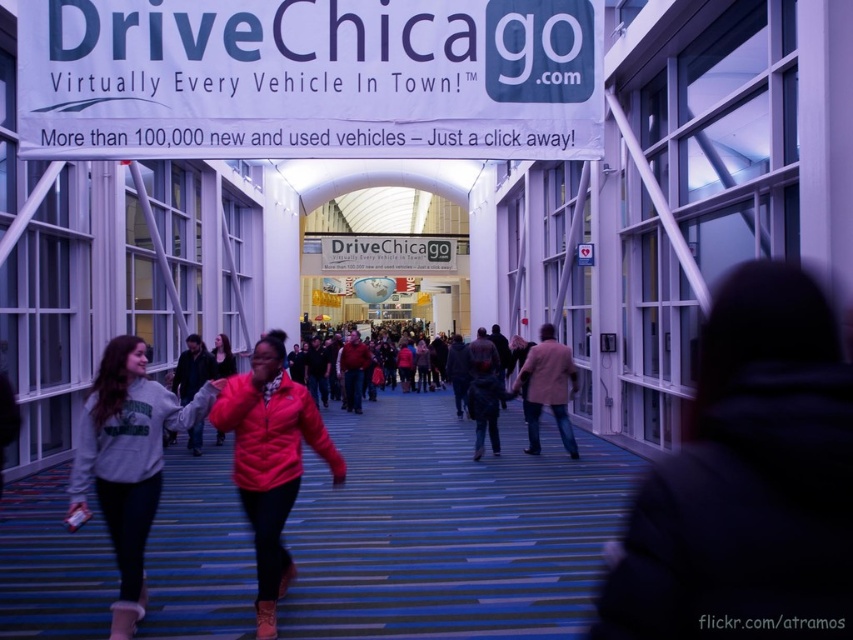
Question: Among these points, which one is farthest from the camera?

Choices:
 (A) (535, 58)
 (B) (556, 380)
 (C) (218, 419)

Answer: (B)

Question: Is matte red puffer jacket at center bigger than white plastic sign at center?

Choices:
 (A) no
 (B) yes

Answer: (B)

Question: Estimate the real-world distances between objects in this image. Which object is farther from the white paper sign at upper center?

Choices:
 (A) gray fleece sweatshirt at center
 (B) white plastic sign at center
 (C) beige woolen jacket at center

Answer: (B)

Question: Is the position of gray fleece sweatshirt at center less distant than that of white plastic sign at center?

Choices:
 (A) yes
 (B) no

Answer: (A)

Question: Does matte red puffer jacket at center have a larger size compared to white plastic sign at center?

Choices:
 (A) yes
 (B) no

Answer: (A)

Question: Which point is closer to the camera?

Choices:
 (A) white paper sign at upper center
 (B) matte red puffer jacket at center

Answer: (B)